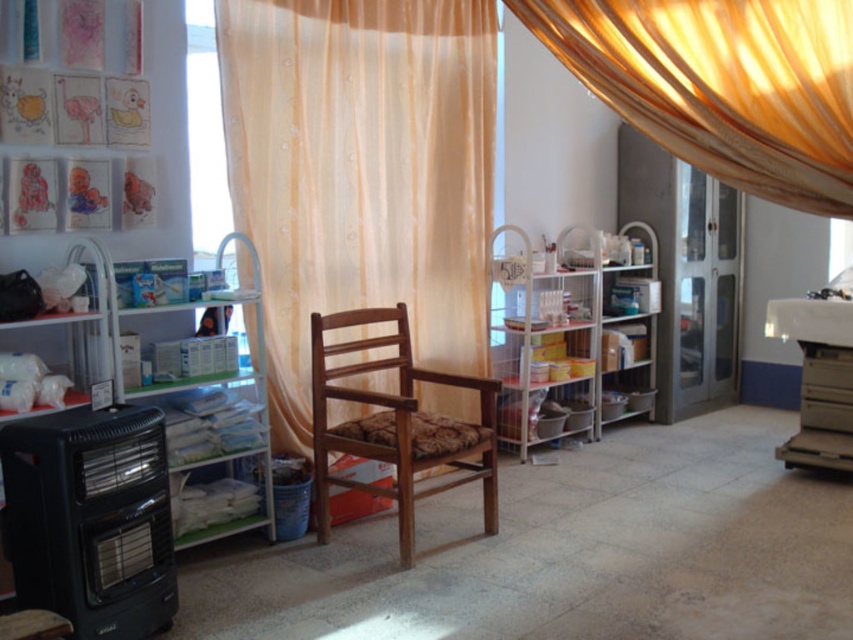
You are a maintenance worker needing to access the metallic gray printer at right. There is a wooden chair at center blocking your path. Can you move the chair to reach the printer?

The wooden chair at center is in front of the metallic gray printer at right, so moving the chair would allow you to access the printer.

You are standing in the room and want to move towards the translucent yellowish curtain at center. Based on its position, which direction should you move from your current position?

The translucent yellowish curtain at center is located at coordinates point (361, 172), so you should move towards that point to reach it.